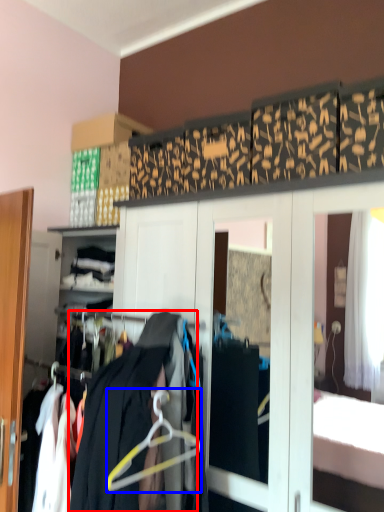
Question: Which point is further to the camera, clothing (highlighted by a red box) or hanger (highlighted by a blue box)?

Choices:
 (A) clothing
 (B) hanger

Answer: (B)